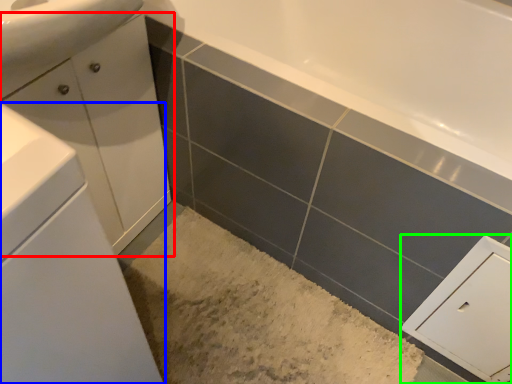
Question: Which is nearer to the bathroom cabinet (highlighted by a red box)? bathroom cabinet (highlighted by a blue box) or cabinetry (highlighted by a green box).

Choices:
 (A) bathroom cabinet
 (B) cabinetry

Answer: (A)